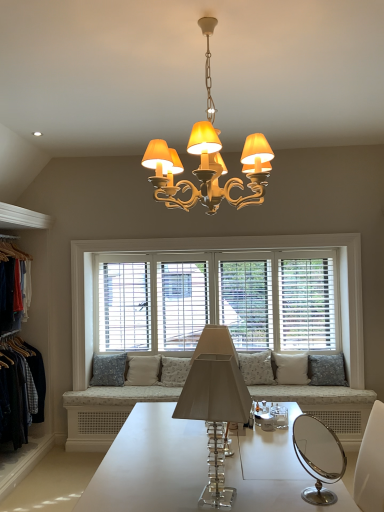
Question: In the image, is beige fabric pillow at center, which appears as the 5th pillow when viewed from the right, on the left side or the right side of white wood window at center?

Choices:
 (A) right
 (B) left

Answer: (B)

Question: Is point (147, 379) closer or farther from the camera than point (74, 302)?

Choices:
 (A) farther
 (B) closer

Answer: (A)

Question: Which of these objects is positioned closest to the white wood window at center?

Choices:
 (A) matte gold chandelier at center, which is counted as the 1th lamp, starting from the top
 (B) floral fabric pillow at center, which is counted as the 4th pillow, starting from the left
 (C) denim jacket at left
 (D) gray fabric pillow at right, which is counted as the 1th pillow, starting from the right
 (E) floral fabric pillow at center, marked as the 1th pillow in a left-to-right arrangement

Answer: (D)

Question: Which is nearer to the white wood window at center?

Choices:
 (A) floral fabric pillow at center, the 3th pillow in the left-to-right sequence
 (B) floral fabric pillow at center, the sixth pillow viewed from the right
 (C) floral fabric pillow at center, acting as the 3th pillow starting from the right
 (D) beige fabric pillow at center, which ranks as the second pillow in left-to-right order
 (E) matte gold chandelier at center, which appears as the second lamp when ordered from the bottom

Answer: (B)